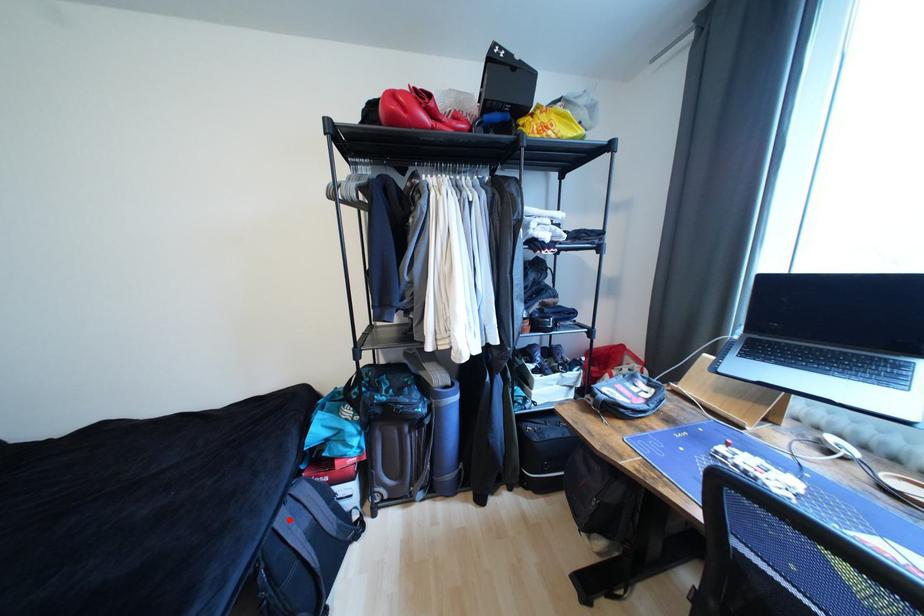
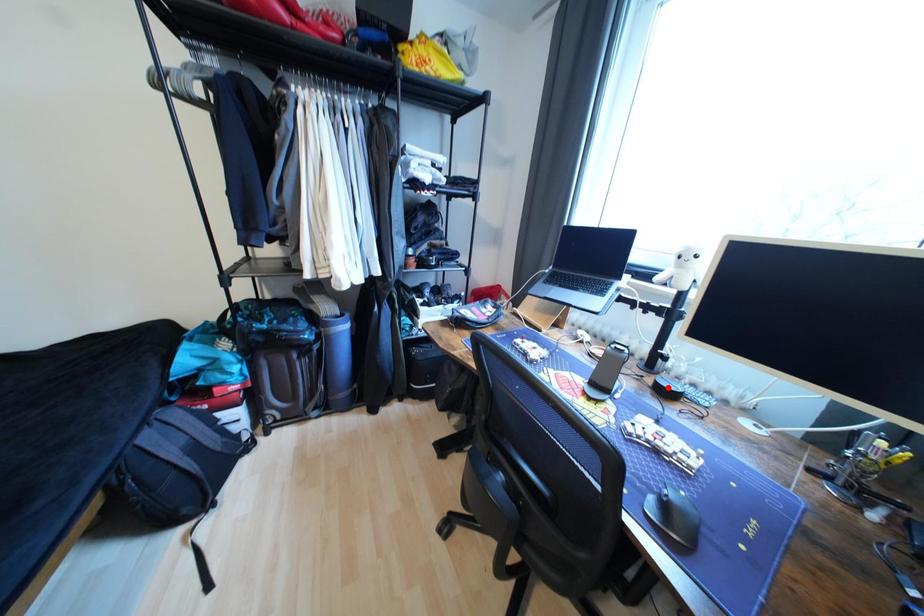
I am providing you with two images of the same scene from different viewpoints. A red point is marked on the first image and another point is marked on the second image. Are the points marked in image1 and image2 representing the same 3D position?

No